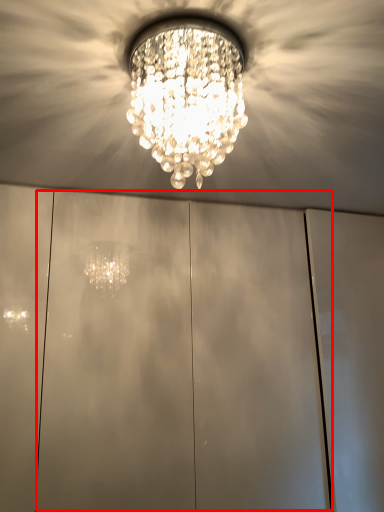
Question: Where is glass door (annotated by the red box) located in relation to lamp in the image?

Choices:
 (A) left
 (B) right

Answer: (B)